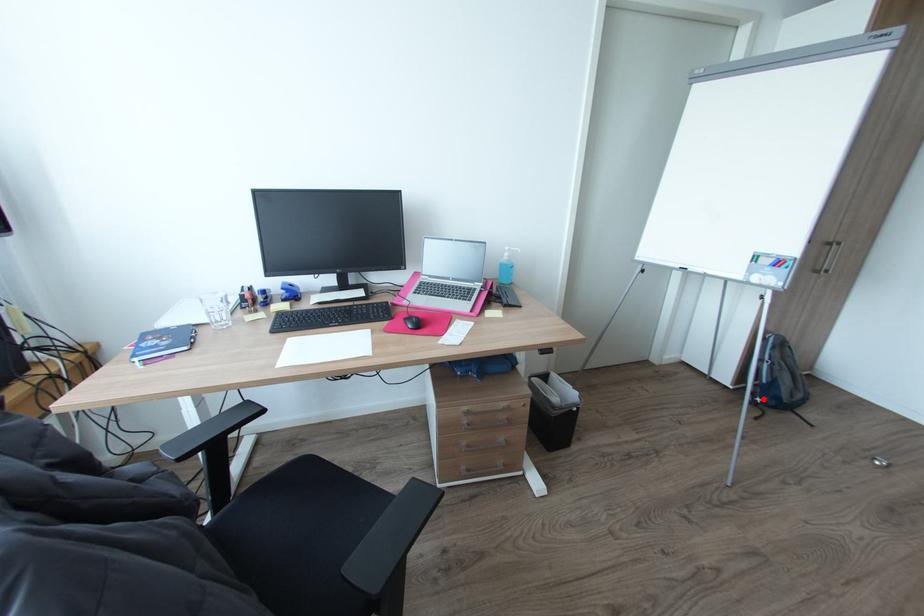
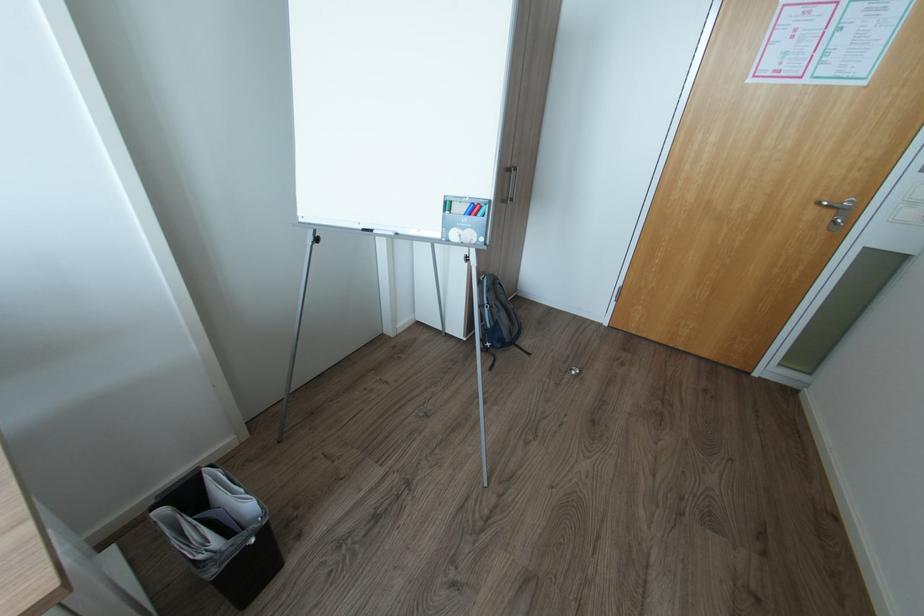
Where in the second image is the point corresponding to the highlighted location from the first image?

(492, 344)